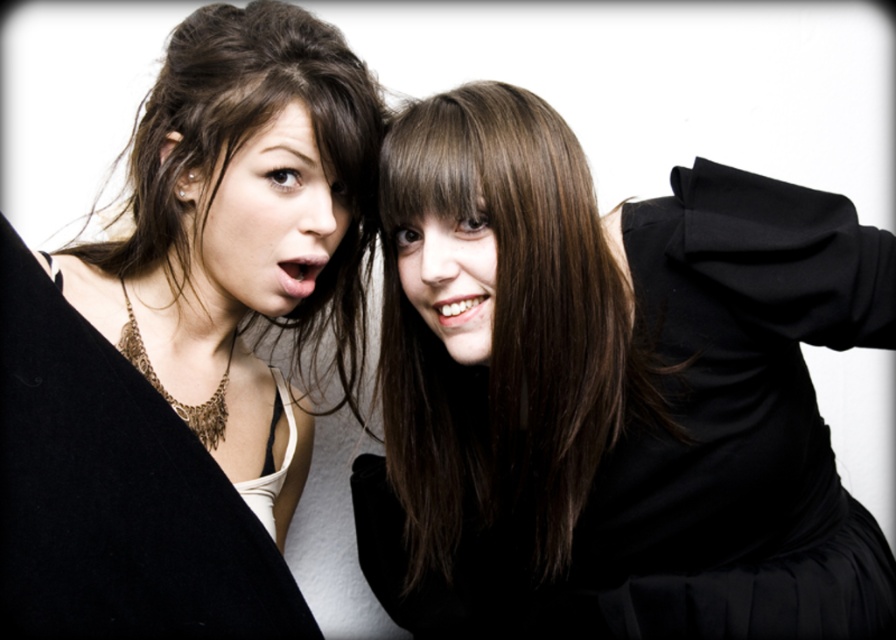
You are a fashion designer trying to decide which garment to feature in a magazine layout. The black matte dress at center and the matte black coat at left are both options. Based on their widths, which one would you choose if you want the featured garment to occupy more space visually?

The black matte dress at center has a greater width than the matte black coat at left, so it would occupy more visual space and be the better choice for the layout.

Looking at this image, looking at the two faces in the image, the matte black face at upper left and the smooth skin face at center, which one is positioned to the left side?

The matte black face at upper left is positioned to the left of the smooth skin face at center.

You are holding a camera and want to take a photo of the scene described in the scene. The camera is at point point (746, 291). If you want to ensure that both people are in focus, what is the minimum distance you should set the camera focus to?

The minimum focus distance should be set to 78.53 centimeters to ensure both people are in focus since the camera is 78.53 centimeters away from the point point (746, 291).